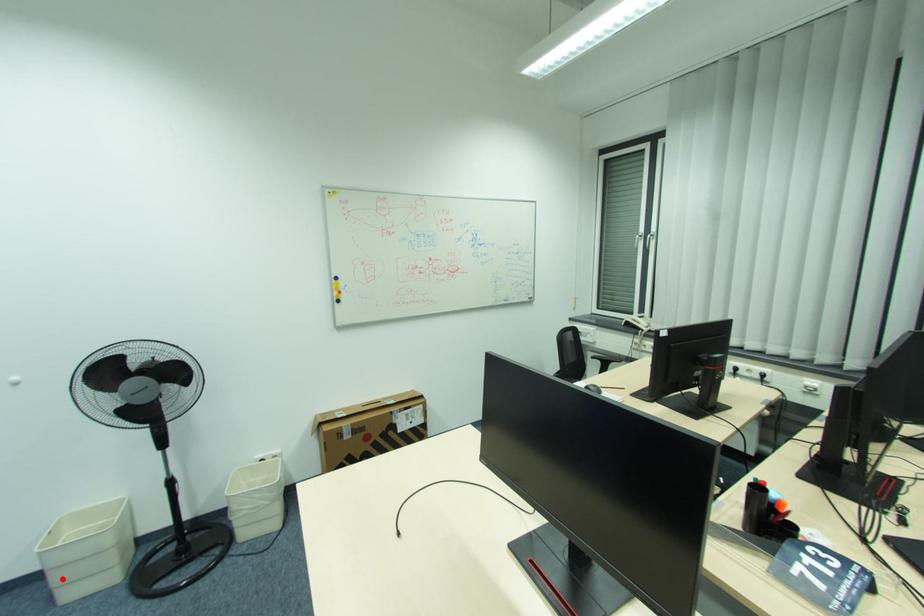
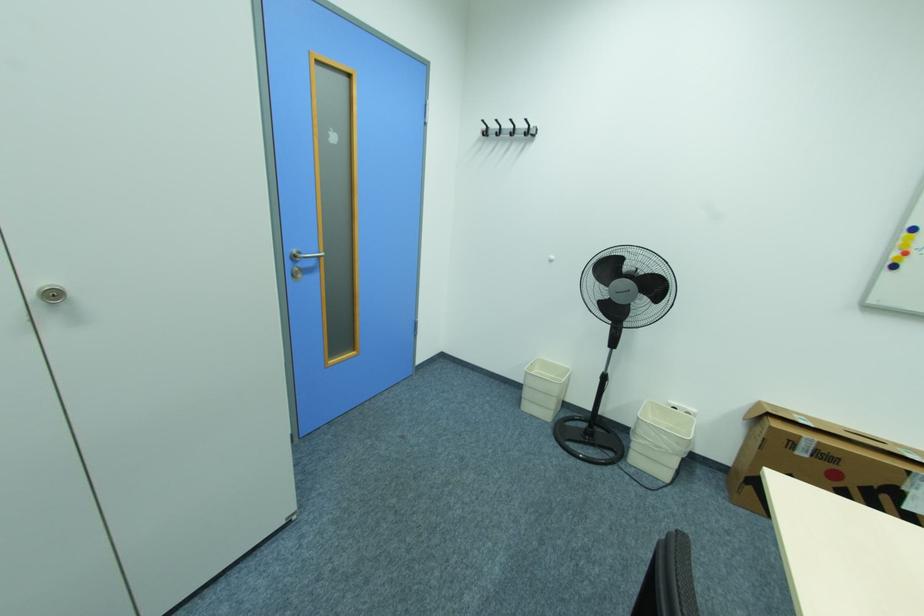
Question: I am providing you with two images of the same scene from different viewpoints. Given a red point in image1, look at the same physical point in image2. Is it:

Choices:
 (A) Closer to the viewpoint
 (B) Farther from the viewpoint

Answer: (B)